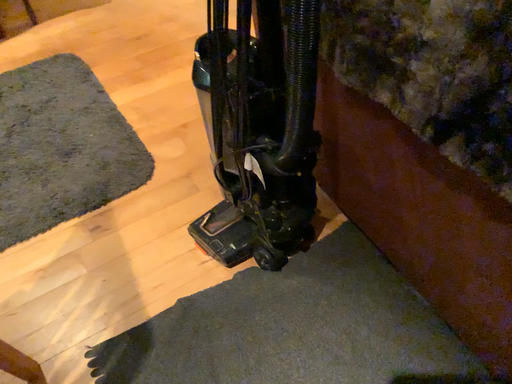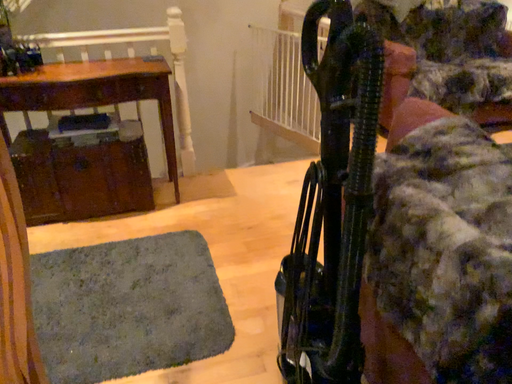
Question: Which way did the camera rotate in the video?

Choices:
 (A) rotated right
 (B) rotated left

Answer: (B)